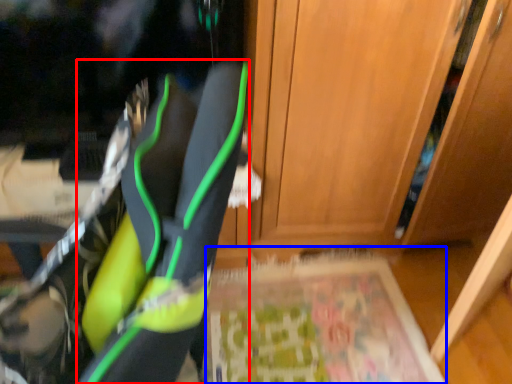
Question: Which point is further to the camera, footwear (highlighted by a red box) or yoga mat (highlighted by a blue box)?

Choices:
 (A) footwear
 (B) yoga mat

Answer: (B)